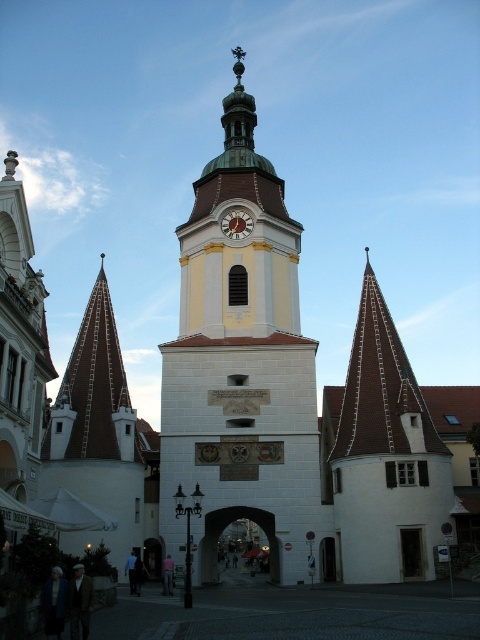
Between yellow stone clock tower at center and gold metallic clock at center, which one is positioned higher?

gold metallic clock at center is higher up.

What do you see at coordinates (240, 365) in the screenshot? This screenshot has height=640, width=480. I see `yellow stone clock tower at center` at bounding box center [240, 365].

Measure the distance between point (252, 432) and camera.

Point (252, 432) is 71.36 meters from camera.

Image resolution: width=480 pixels, height=640 pixels. I want to click on yellow stone clock tower at center, so click(x=240, y=365).